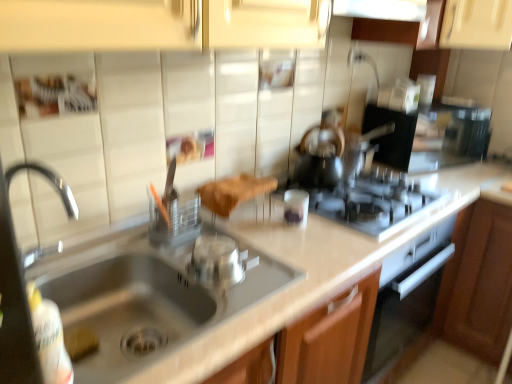
Where is `vacant space that is in between transparent glass candle at center, which is counted as the first appliance, starting from the right, and silver metallic pot at center, which is the second appliance from right to left`? This screenshot has height=384, width=512. vacant space that is in between transparent glass candle at center, which is counted as the first appliance, starting from the right, and silver metallic pot at center, which is the second appliance from right to left is located at coordinates (259, 249).